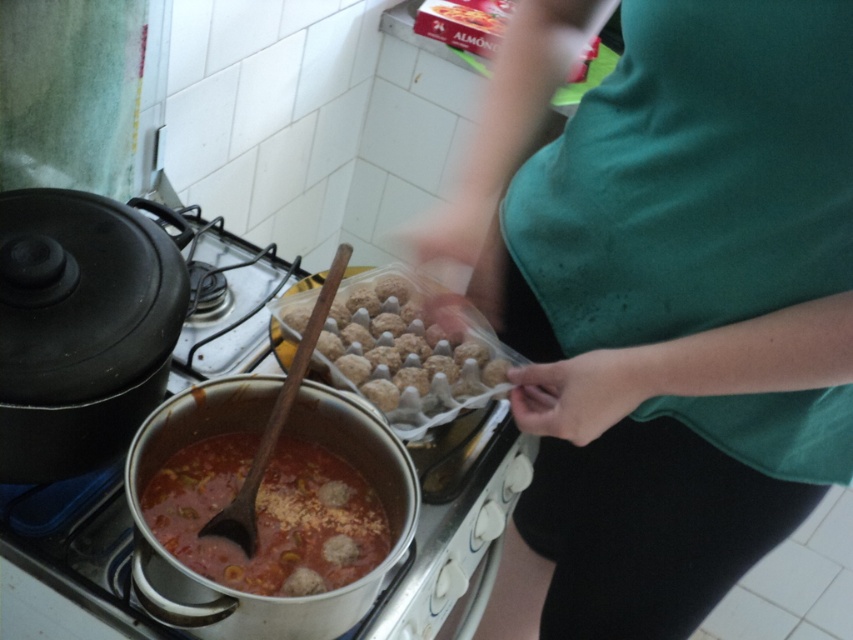
Question: Is the position of green fabric shirt at upper center more distant than that of stainless steel stove at center?

Choices:
 (A) no
 (B) yes

Answer: (A)

Question: Which object appears closest to the camera in this image?

Choices:
 (A) stainless steel stove at center
 (B) brown matte meatballs at center

Answer: (A)

Question: Can you confirm if green fabric shirt at upper center is positioned below brown matte meatballs at center?

Choices:
 (A) no
 (B) yes

Answer: (B)

Question: Which of these objects is positioned closest to the brown matte meatballs at center?

Choices:
 (A) tomato-based meatballs at center
 (B) stainless steel stove at center
 (C) green fabric shirt at upper center

Answer: (B)

Question: Does green fabric shirt at upper center have a lesser width compared to brown matte meatballs at center?

Choices:
 (A) no
 (B) yes

Answer: (A)

Question: Which of the following is the farthest from the observer?

Choices:
 (A) stainless steel stove at center
 (B) tomato-based meatballs at center
 (C) brown matte meatballs at center
 (D) green fabric shirt at upper center

Answer: (C)